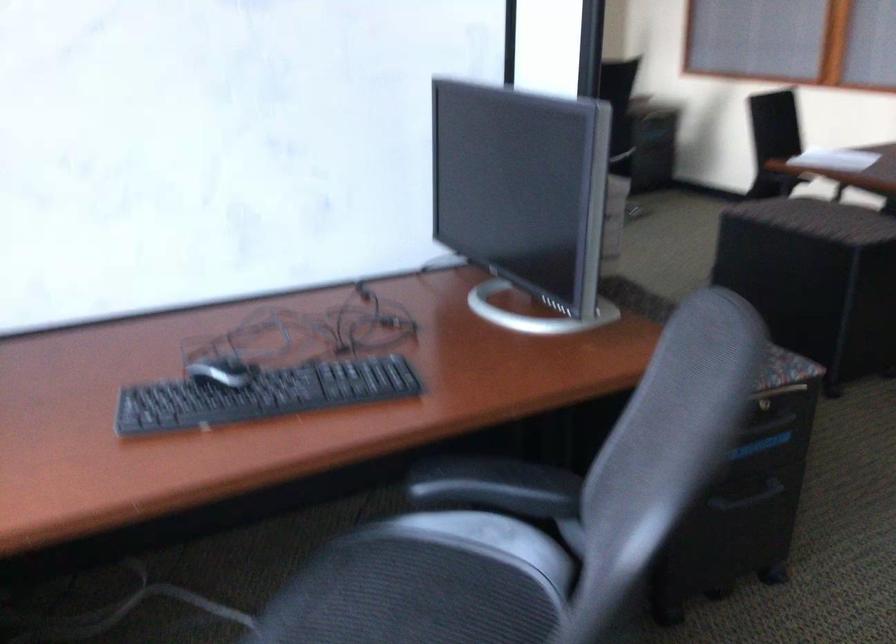
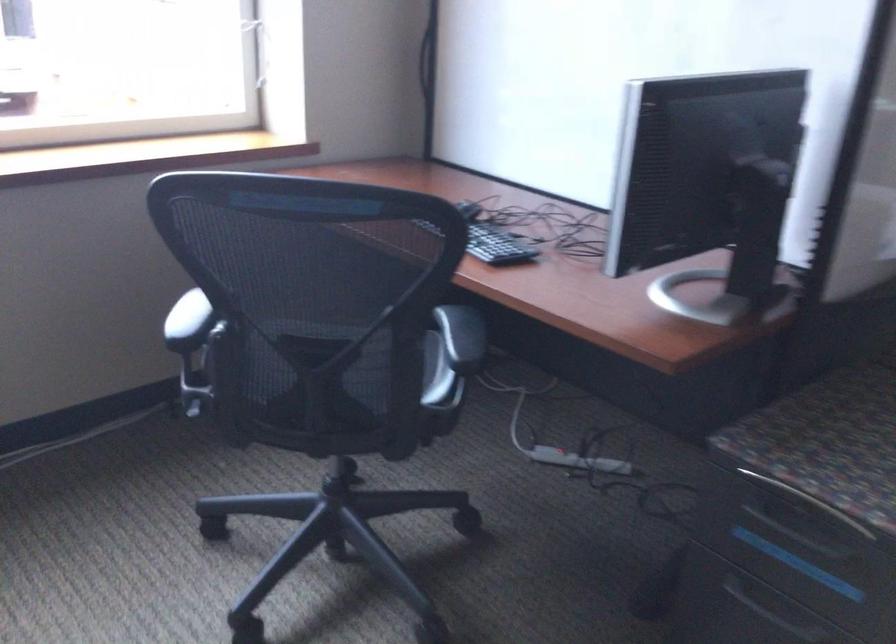
The point at [486,563] is marked in the first image. Where is the corresponding point in the second image?

(435, 373)